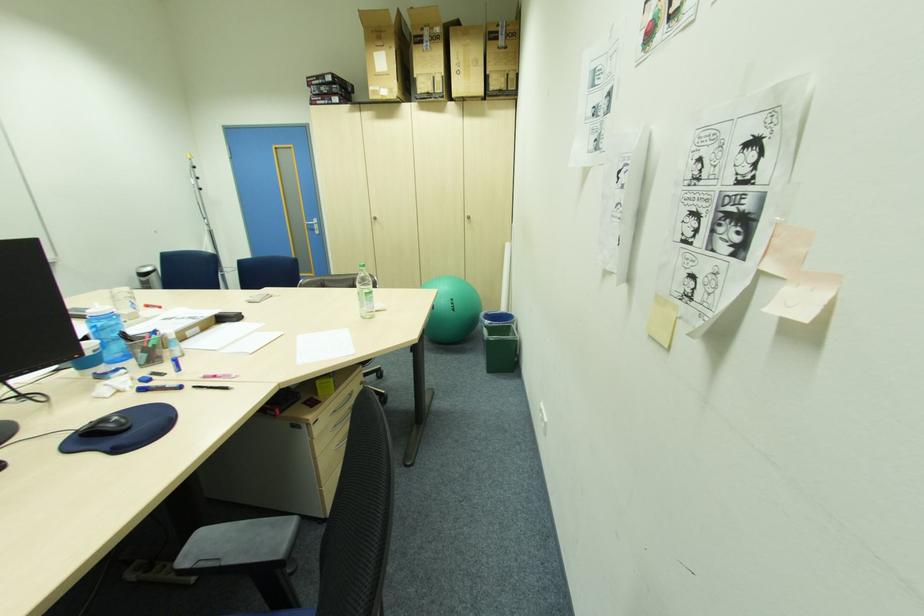
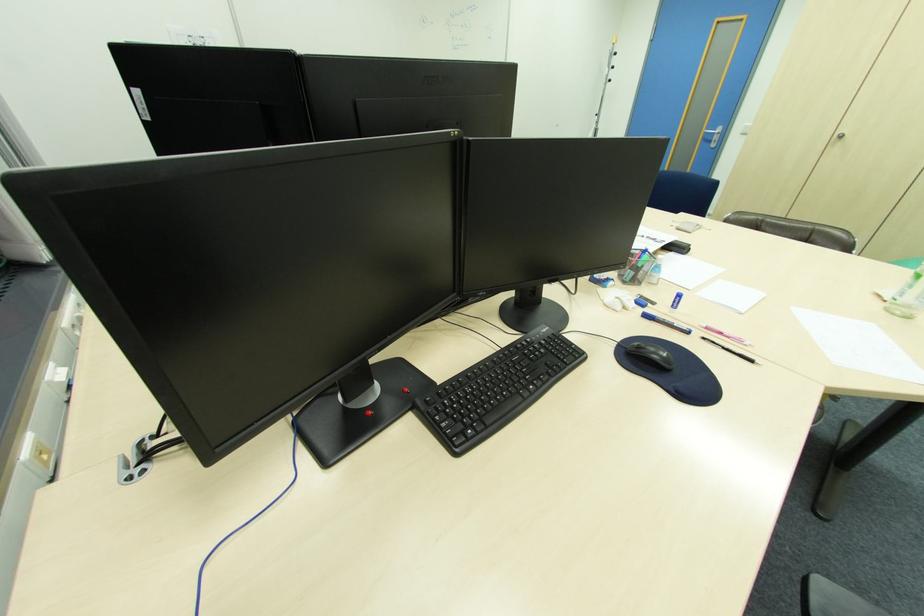
Locate, in the second image, the point that corresponds to [210,378] in the first image.

(712, 328)